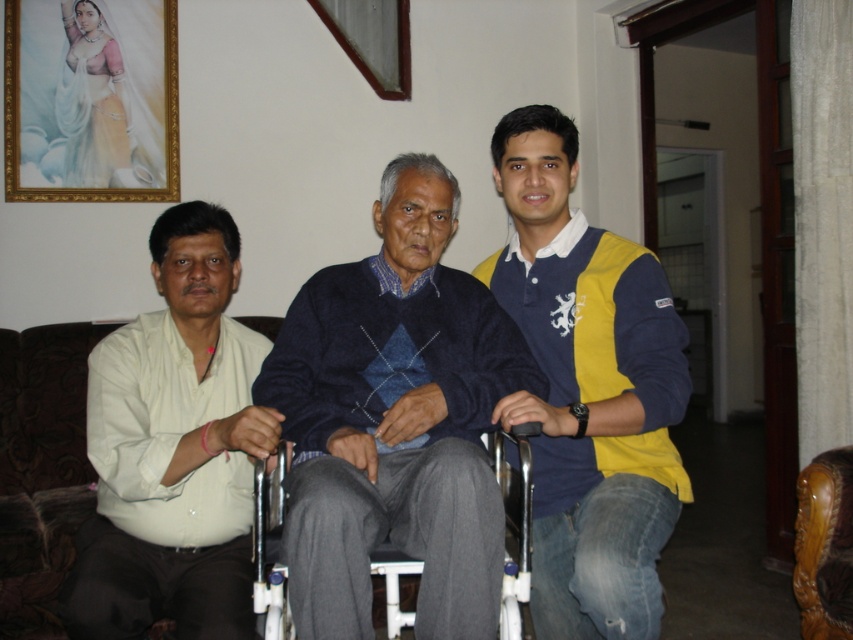
Question: Which object is farther from the camera taking this photo?

Choices:
 (A) brown leather chair at lower right
 (B) gold-framed portrait at upper left

Answer: (B)

Question: Can you confirm if yellow-blue polo shirt at center is bigger than gray fabric wheelchair at center?

Choices:
 (A) yes
 (B) no

Answer: (A)

Question: Is yellow-blue polo shirt at center positioned behind gray fabric wheelchair at center?

Choices:
 (A) yes
 (B) no

Answer: (B)

Question: Which object appears closest to the camera in this image?

Choices:
 (A) brown leather chair at lower right
 (B) white matte shirt at left
 (C) yellow-blue polo shirt at center
 (D) gray fabric wheelchair at center

Answer: (C)

Question: Which object is farther from the camera taking this photo?

Choices:
 (A) brown leather chair at lower right
 (B) yellow-blue polo shirt at center

Answer: (A)

Question: Is dark blue sweater at center positioned before yellow-blue polo shirt at center?

Choices:
 (A) yes
 (B) no

Answer: (A)